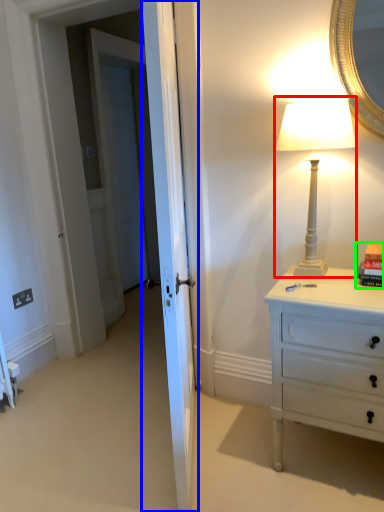
Question: Estimate the real-world distances between objects in this image. Which object is closer to bedside lamp (highlighted by a red box), door (highlighted by a blue box) or book (highlighted by a green box)?

Choices:
 (A) door
 (B) book

Answer: (B)